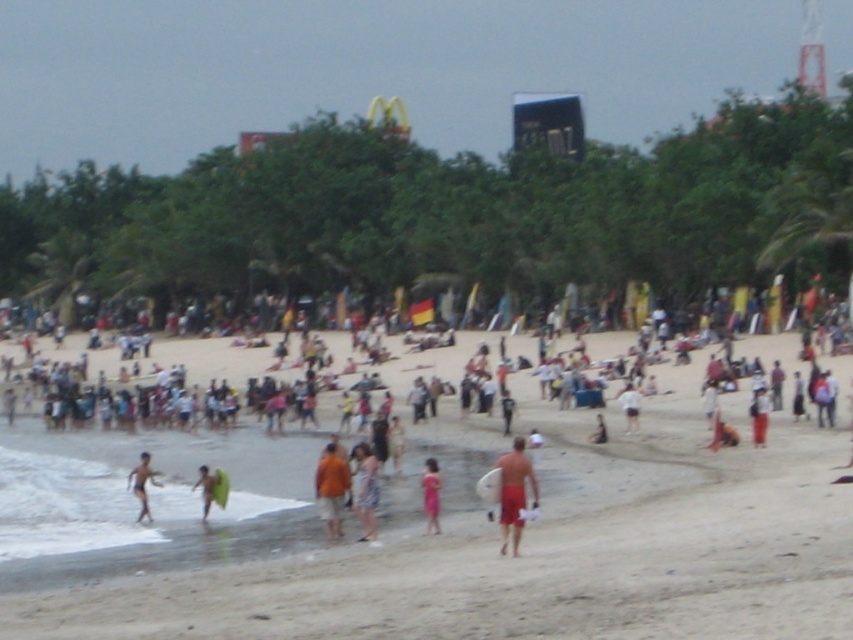
Question: Does orange fabric shirt at center have a lesser width compared to smooth tan skin at center?

Choices:
 (A) no
 (B) yes

Answer: (B)

Question: Which of the following is the closest to the observer?

Choices:
 (A) (637, 404)
 (B) (329, 452)

Answer: (B)

Question: Does matte red shorts at lower right have a larger size compared to smooth skin person at center?

Choices:
 (A) yes
 (B) no

Answer: (A)

Question: Can you confirm if matte red shorts at lower right is positioned below smooth skin person at center?

Choices:
 (A) yes
 (B) no

Answer: (B)

Question: Which point is farther to the camera?

Choices:
 (A) red matte surfboard at center
 (B) pink fabric dress at center

Answer: (B)

Question: Considering the real-world distances, which object is closest to the beige sand at center?

Choices:
 (A) light blue denim shorts at center
 (B) matte red shorts at lower right
 (C) smooth tan skin at center
 (D) smooth skin person at center

Answer: (B)